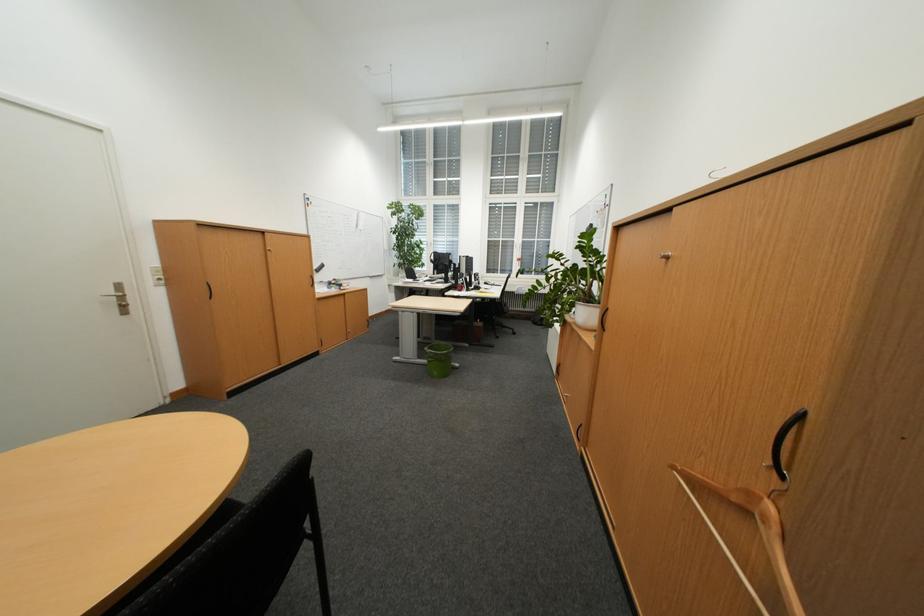
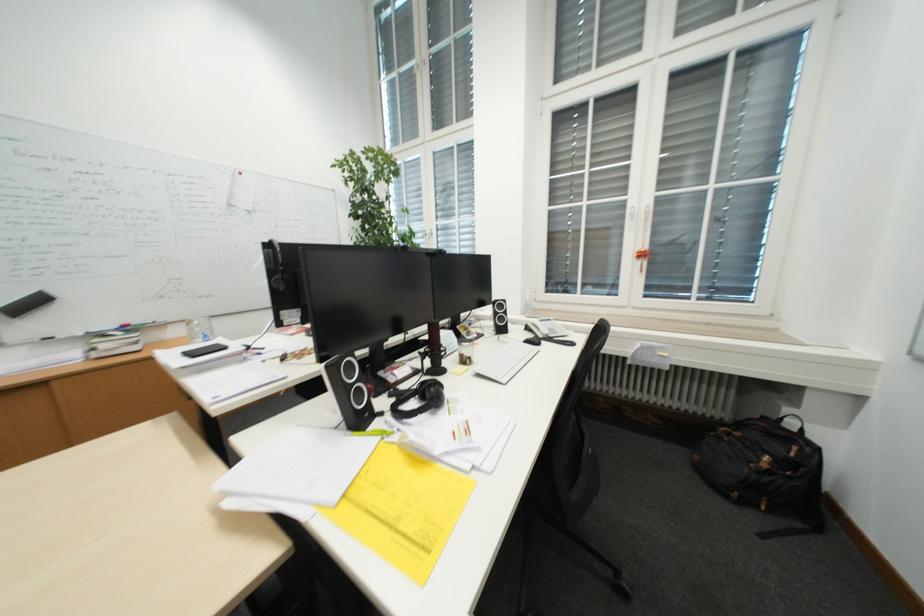
Question: In a continuous first-person perspective shot, in which direction is the camera moving?

Choices:
 (A) Left
 (B) Right
 (C) Forward
 (D) Backward

Answer: (C)